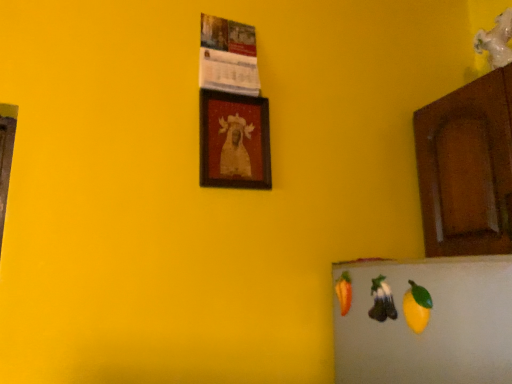
Question: Looking at the image, does wooden framed portrait at center seem bigger or smaller compared to yellow matte fruit at lower right, which is counted as the first fruit, starting from the front?

Choices:
 (A) big
 (B) small

Answer: (A)

Question: In the image, is wooden framed portrait at center on the left side or the right side of yellow matte fruit at lower right, which is the second fruit in back-to-front order?

Choices:
 (A) left
 (B) right

Answer: (A)

Question: Based on their relative distances, which object is nearer to the wooden framed portrait at center?

Choices:
 (A) brown wood cabinet at right
 (B) yellow matte fruit at lower right, which is counted as the first fruit, starting from the front
 (C) shiny purple grapes at lower right, the second fruit from the front

Answer: (C)

Question: Considering the real-world distances, which object is farthest from the shiny purple grapes at lower right, the second fruit from the front?

Choices:
 (A) brown wood cabinet at right
 (B) yellow matte fruit at lower right, which is counted as the first fruit, starting from the front
 (C) wooden framed portrait at center

Answer: (C)